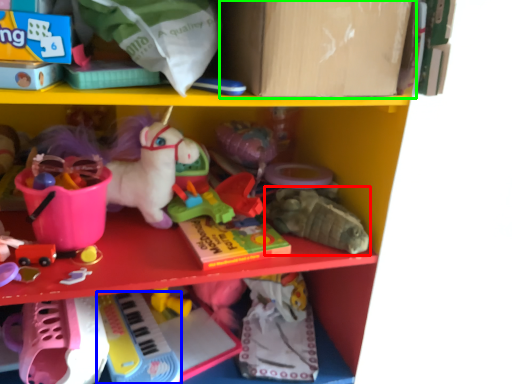
Question: Which object is positioned closest to toy (highlighted by a red box)? Select from toy (highlighted by a blue box) and cardboard box (highlighted by a green box).

Choices:
 (A) toy
 (B) cardboard box

Answer: (B)